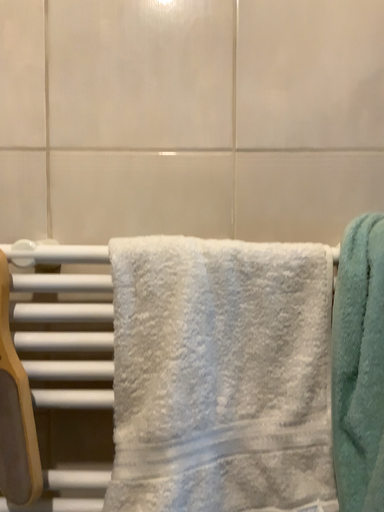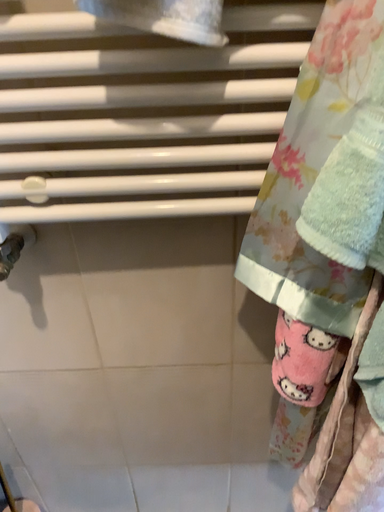
Question: Which way did the camera rotate in the video?

Choices:
 (A) rotated downward
 (B) rotated upward

Answer: (A)